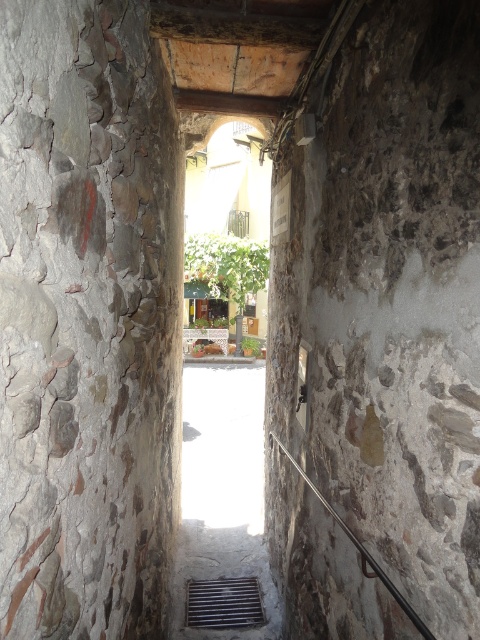
You are a delivery person carrying a box that is 1.2 meters wide. You need to pass through the narrow stone passageway. There is a metallic grate at lower center and a black metal rail at lower center in your path. Can your box fit through the space between these two objects?

The metallic grate at lower center is wider than the black metal rail at lower center. However, since the passageway itself is narrow, you need to check the total available width between the two objects. If the combined width of the grate and rail plus any spacing between them is less than 1.2 meters, the box might not fit. But based on the description alone, we can only confirm the grate is wider than the rail, not the total passage width.

You are standing in the narrow stone passageway and want to walk towards the brighter outdoor area. There are two points marked in the scene, point (205,627) and point (372,560). Which point should you aim for to move closer to the exit?

You should aim for point (205,627) because it is closer to you than point (372,560), so moving towards it will bring you nearer to the exit.

You are standing at the entrance of the stone passageway and want to walk towards the bright outdoor area. There is a metallic grate at lower center and a black metal rail at lower center in your path. Which object should you avoid stepping on to continue moving forward?

You should avoid stepping on the metallic grate at lower center because it is positioned to the left of the black metal rail at lower center, so stepping on the grate might block your path forward.